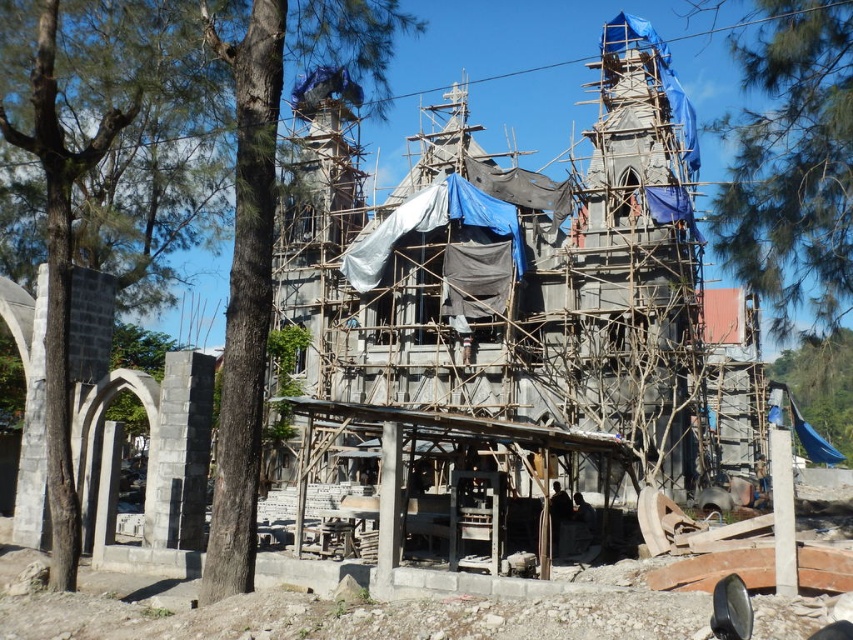
Between green leafy tree at left and green leafy tree at upper right, which one is positioned higher?

green leafy tree at left

Can you confirm if green leafy tree at left is thinner than green leafy tree at upper right?

Incorrect, green leafy tree at left's width is not less than green leafy tree at upper right's.

At what (x,y) coordinates should I click in order to perform the action: click on green leafy tree at left. Please return your answer as a coordinate pair (x, y). This screenshot has width=853, height=640. Looking at the image, I should click on (99, 163).